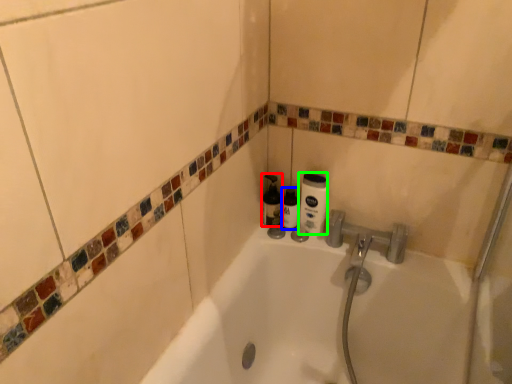
Question: Which is farther away from bottle (highlighted by a red box)? toiletry (highlighted by a blue box) or cleaning product (highlighted by a green box)?

Choices:
 (A) toiletry
 (B) cleaning product

Answer: (B)